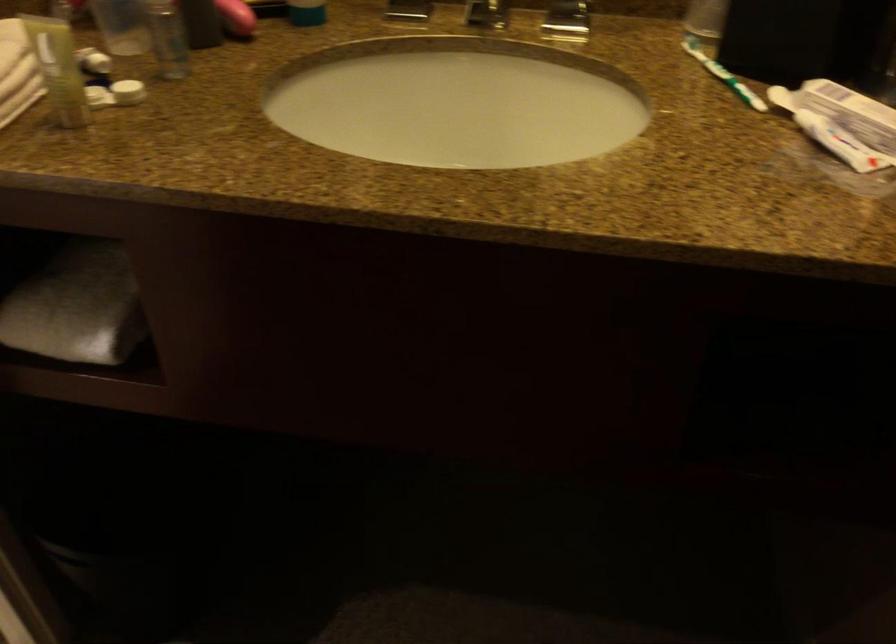
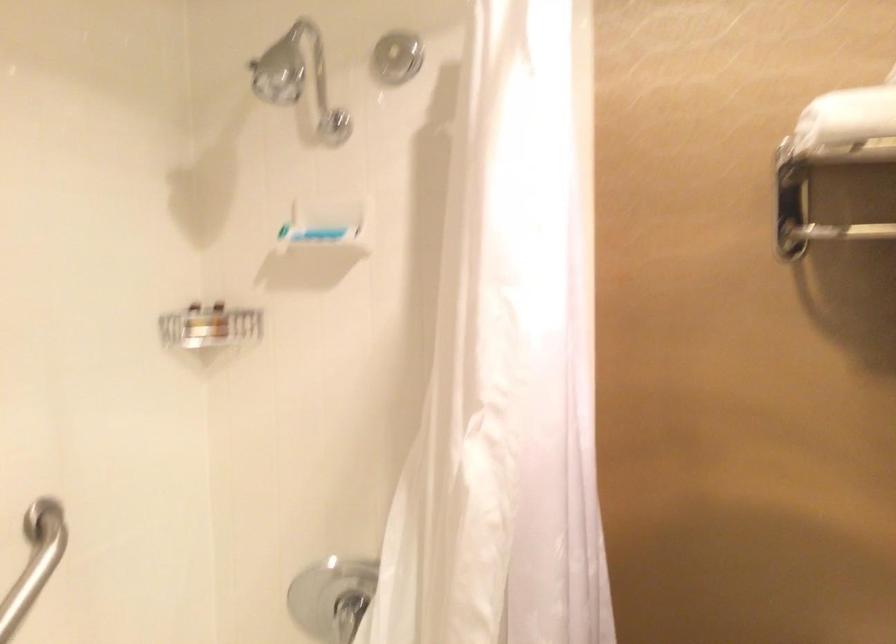
Question: The camera is either moving clockwise (left) or counter-clockwise (right) around the object. The first image is from the beginning of the video and the second image is from the end. Is the camera moving left or right when shooting the video?

Choices:
 (A) Left
 (B) Right

Answer: (B)